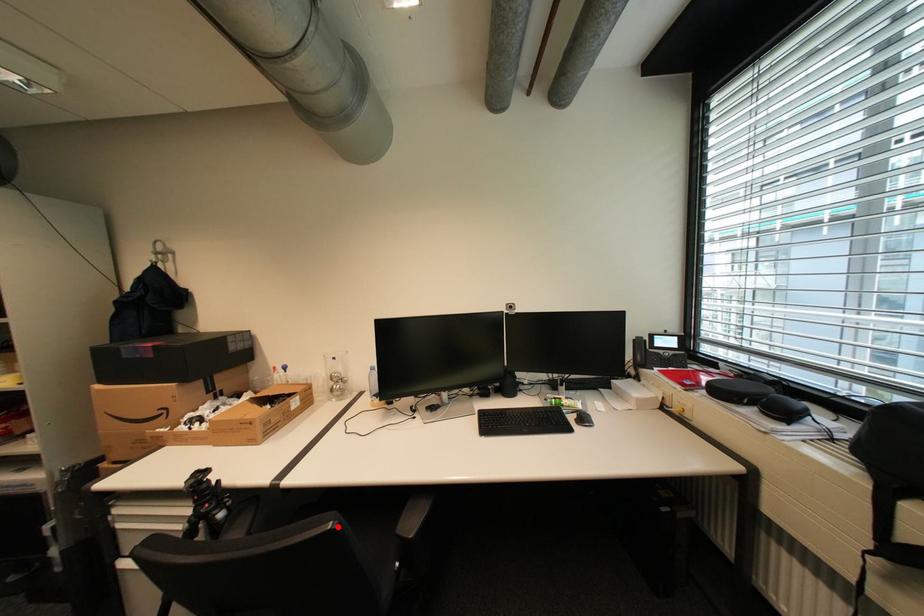
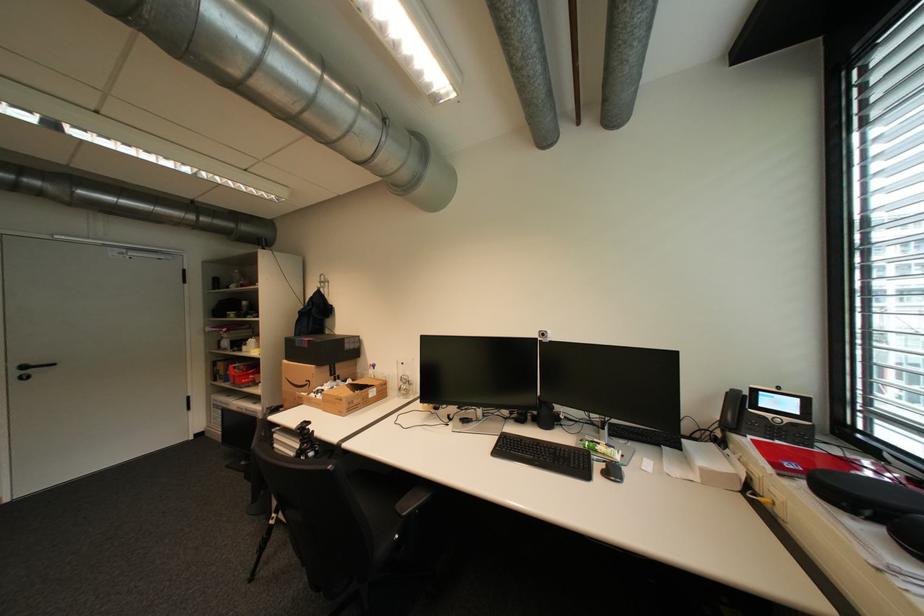
In the second image, find the point that corresponds to the highlighted location in the first image.

(337, 468)